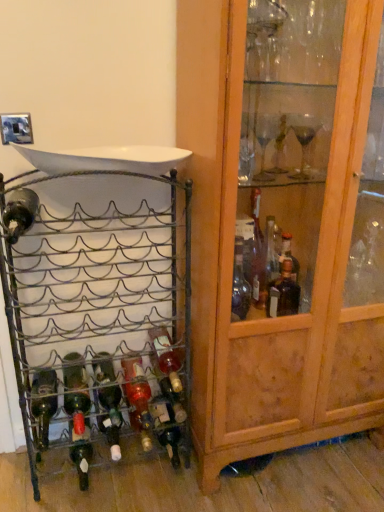
In order to click on vacant space to the left of translucent glass bottle at lower left, arranged as the 4th bottle when viewed from the right in this screenshot , I will do `click(46, 472)`.